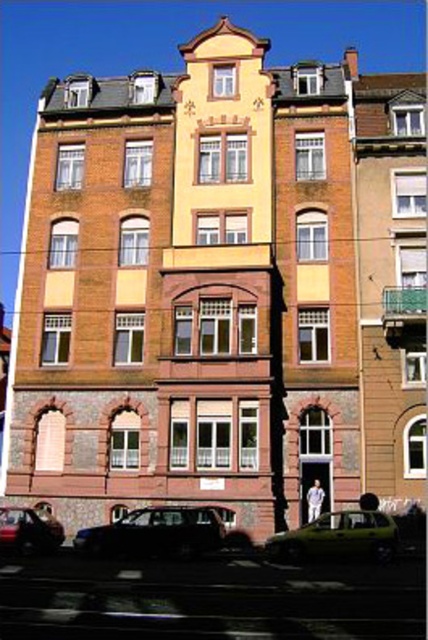
Between shiny black car at lower center and green matte car at center, which one has less height?

shiny black car at lower center is shorter.

Which is in front, point (214, 518) or point (279, 554)?

Point (279, 554)

Find the location of `shiny black car at lower center`. shiny black car at lower center is located at coordinates (154, 532).

You are a GUI agent. You are given a task and a screenshot of the screen. Output one action in this format:
    pyautogui.click(x=<x>, y=<y>)
    Task: Click on the green matte car at center
    
    Given the screenshot: What is the action you would take?
    pyautogui.click(x=338, y=538)

Does green matte car at center appear on the right side of shiny black car at lower left?

Indeed, green matte car at center is positioned on the right side of shiny black car at lower left.

Is point (386, 548) positioned after point (14, 548)?

No, it is in front of (14, 548).

In order to click on green matte car at center in this screenshot , I will do `click(338, 538)`.

From the picture: Between shiny black car at lower center and shiny black car at lower left, which one is positioned higher?

shiny black car at lower center

Which is behind, point (166, 531) or point (0, 532)?

The point (0, 532) is more distant.

Measure the distance between point [151,552] and camera.

A distance of 46.76 meters exists between point [151,552] and camera.

At what (x,y) coordinates should I click in order to perform the action: click on shiny black car at lower center. Please return your answer as a coordinate pair (x, y). The height and width of the screenshot is (640, 428). Looking at the image, I should click on (154, 532).